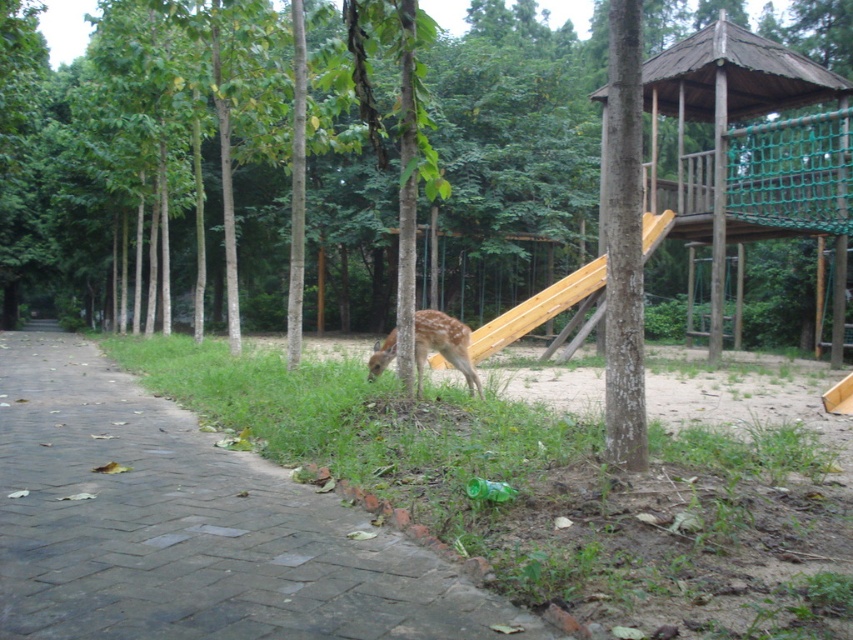
You are a parent watching your child play in the playground. You see the wooden smooth slide at center and the fawn fur deer at center. Which object is taller?

The wooden smooth slide at center is taller than the fawn fur deer at center.

You are a park maintenance worker needing to place a new bench along the brick paved path at center. Considering the brown rough tree at center, would the bench fit between them if the bench is 1.2 meters wide?

The brown rough tree at center is wider than the brick paved path at center, so placing a 1.2 meter wide bench between them may not be feasible as the path itself may not have enough space due to the tree occupying more width.